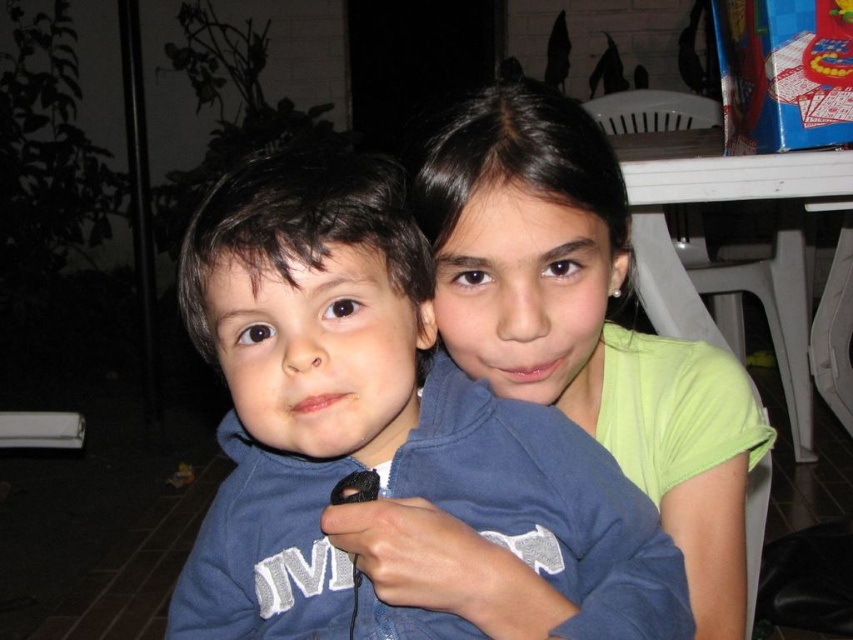
Question: Which object is closer to the camera taking this photo?

Choices:
 (A) light green fabric shirt at upper right
 (B) blue fleece jacket at center

Answer: (B)

Question: Does blue fleece jacket at center have a larger size compared to light green fabric shirt at upper right?

Choices:
 (A) no
 (B) yes

Answer: (A)

Question: Can you confirm if blue fleece jacket at center is bigger than light green fabric shirt at upper right?

Choices:
 (A) no
 (B) yes

Answer: (A)

Question: Does blue fleece jacket at center have a smaller size compared to light green fabric shirt at upper right?

Choices:
 (A) no
 (B) yes

Answer: (B)